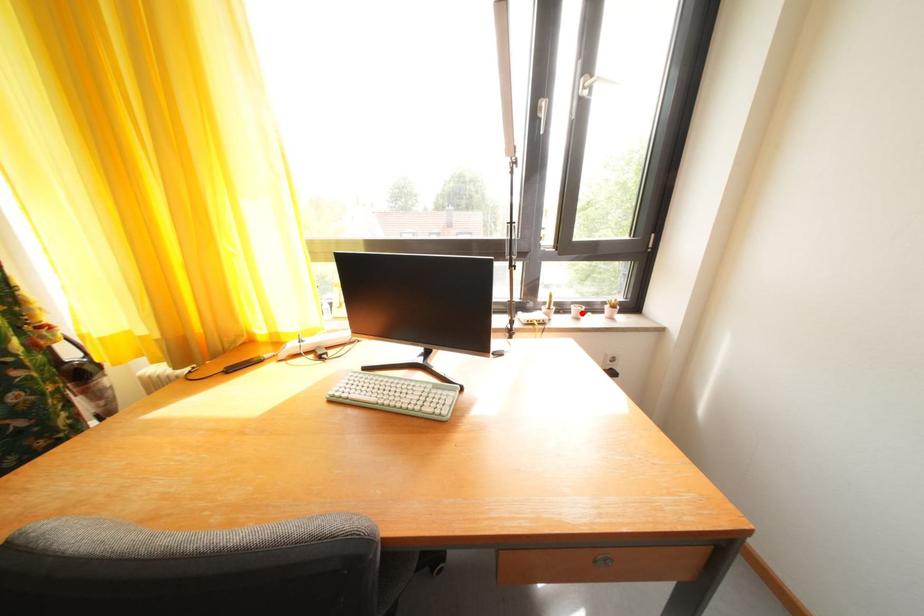
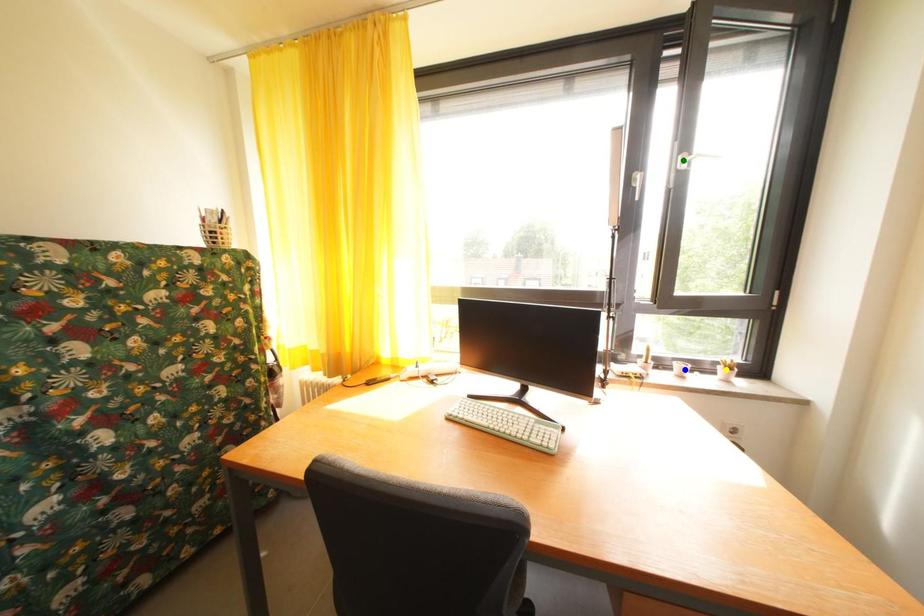
Question: I am providing you with two images of the same scene from different viewpoints. A red point is marked on the first image. You are given multiple points on the second image. Can you choose the point in image 2 that corresponds to the point in image 1?

Choices:
 (A) yellow point
 (B) green point
 (C) blue point

Answer: (C)